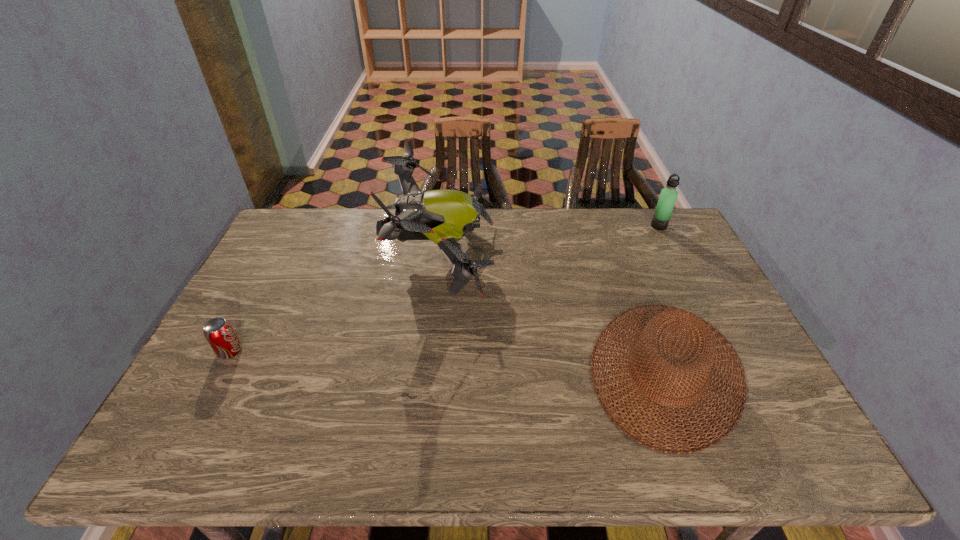
Where is `drone located at the far edge`? The image size is (960, 540). drone located at the far edge is located at coordinates (443, 216).

Find the location of a particular element. thermos bottle at the far edge is located at coordinates (668, 195).

Identify the location of object that is at the near edge. The image size is (960, 540). (700, 329).

Identify the location of object at the left edge. Image resolution: width=960 pixels, height=540 pixels. (219, 333).

The image size is (960, 540). Identify the location of thermos bottle present at the right edge. (668, 195).

You are a GUI agent. You are given a task and a screenshot of the screen. Output one action in this format:
    pyautogui.click(x=<x>, y=<y>)
    Task: Click on the sunhat at the right edge
    The height and width of the screenshot is (540, 960).
    Given the screenshot: What is the action you would take?
    pyautogui.click(x=700, y=329)

Locate an element on the screen. object that is at the far right corner is located at coordinates (668, 195).

Find the location of a particular element. object situated at the near right corner is located at coordinates (700, 329).

Locate an element on the screen. Image resolution: width=960 pixels, height=540 pixels. vacant space at the far edge of the desktop is located at coordinates (352, 220).

You are a GUI agent. You are given a task and a screenshot of the screen. Output one action in this format:
    pyautogui.click(x=<x>, y=<y>)
    Task: Click on the free location at the near edge of the desktop
    The height and width of the screenshot is (540, 960).
    Given the screenshot: What is the action you would take?
    pyautogui.click(x=524, y=431)